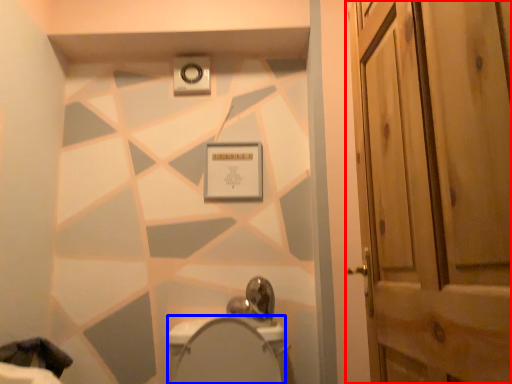
Question: Which object is closer to the camera taking this photo, door (highlighted by a red box) or bidet (highlighted by a blue box)?

Choices:
 (A) door
 (B) bidet

Answer: (A)